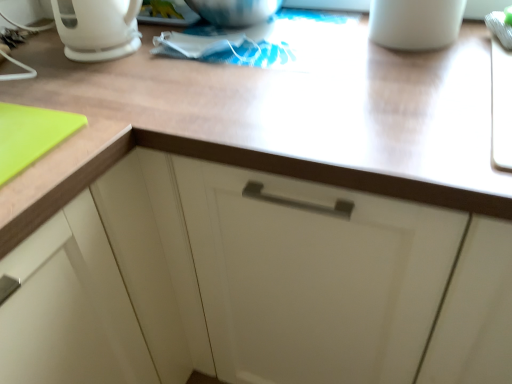
Question: Which is correct: white glossy coffee pot at upper left is inside white matte mug at upper right, or outside of it?

Choices:
 (A) outside
 (B) inside

Answer: (A)

Question: From the image's perspective, relative to white matte mug at upper right, is white glossy coffee pot at upper left above or below?

Choices:
 (A) below
 (B) above

Answer: (A)

Question: Which object is the farthest from the white glossy coffee pot at upper left?

Choices:
 (A) white matte mug at upper right
 (B) wooden at upper center

Answer: (A)

Question: Estimate the real-world distances between objects in this image. Which object is farther from the wooden at upper center?

Choices:
 (A) white glossy coffee pot at upper left
 (B) white matte mug at upper right

Answer: (A)